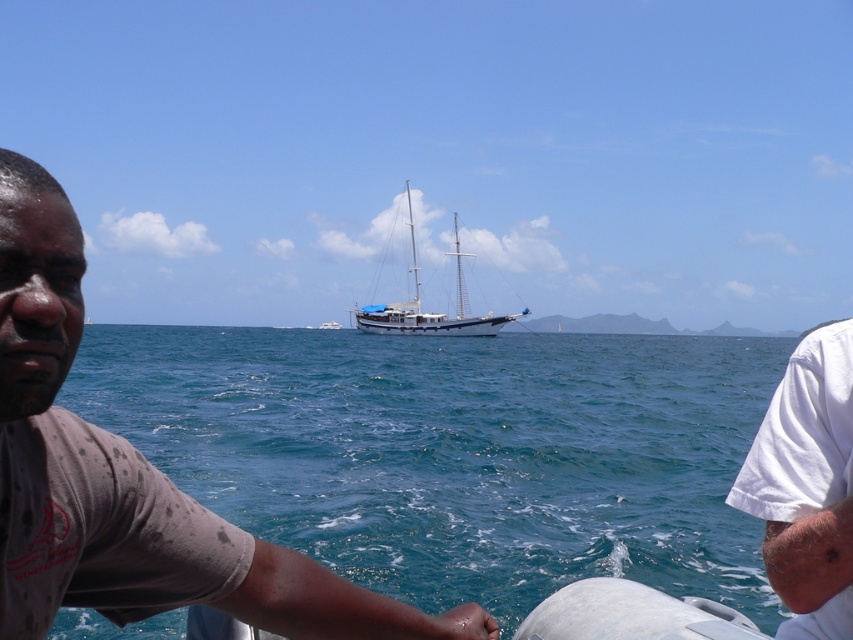
You are an observer on the boat and want to know which object occupies more horizontal space in the scene. Which one is wider between the blue water at center and the brown cotton shirt at left?

The blue water at center is wider than the brown cotton shirt at left.

You are an observer on the shore looking at the blue water at center and the blue matte sailboat at center. Which one appears taller in the scene?

The blue matte sailboat at center appears taller than the blue water at center in the scene.